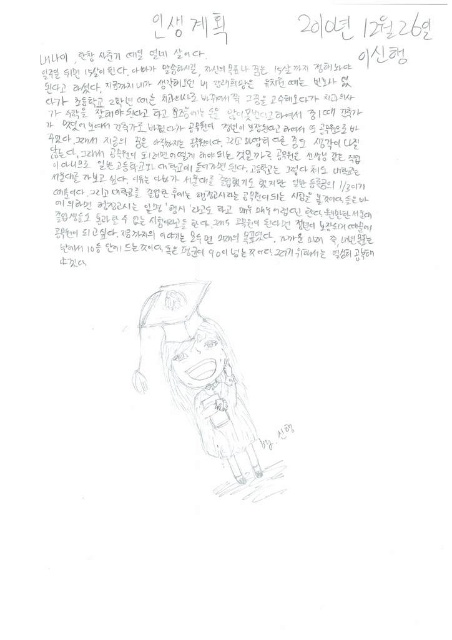
Who is positioned more to the left, black paper at center or sketchy pencil drawing of a person at center?

sketchy pencil drawing of a person at center is more to the left.

Who is taller, black paper at center or sketchy pencil drawing of a person at center?

black paper at center is taller.

The width and height of the screenshot is (452, 640). I want to click on black paper at center, so click(x=216, y=147).